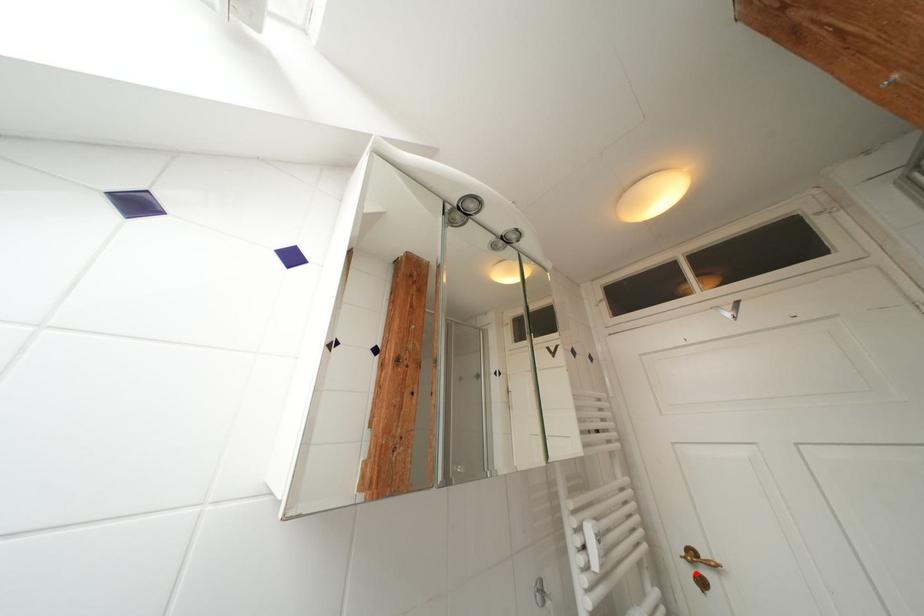
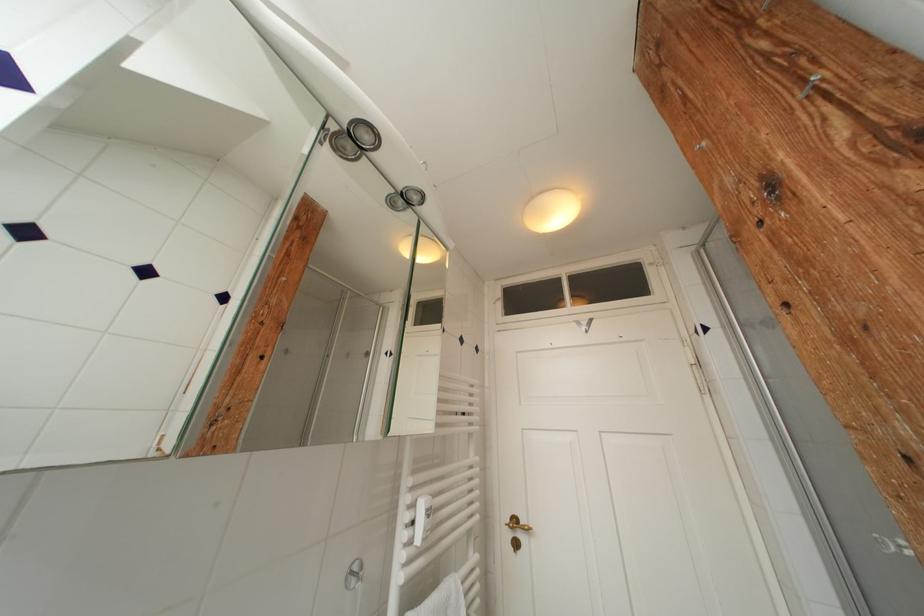
Where in the second image is the point corresponding to the highlighted location from the first image?

(516, 539)